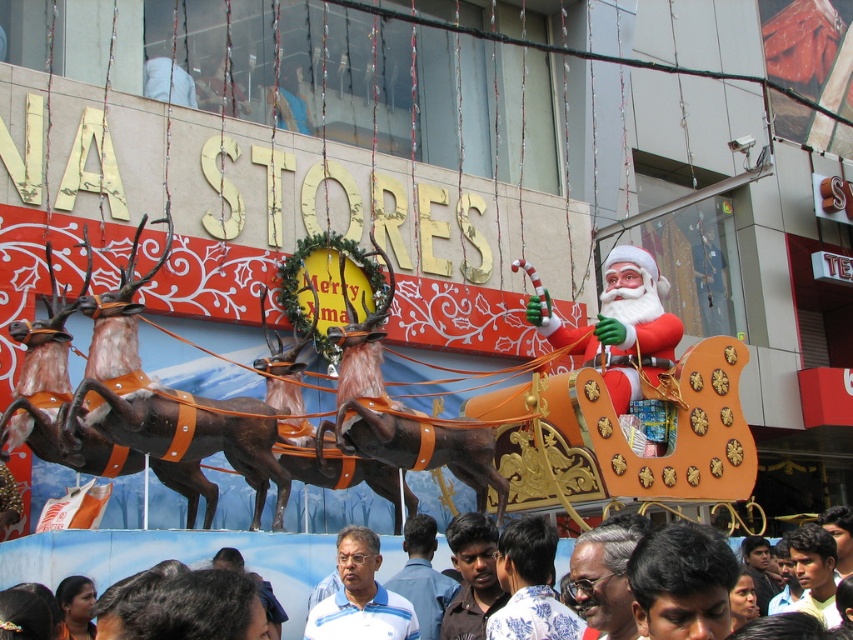
You are a parade attendee standing at the front of the float. You want to hand a gift to the red glossy santa claus at center but also need to avoid stepping on the white fabric shirt at lower center. Can you reach Santa without stepping on the shirt?

The distance between the red glossy santa claus at center and the white fabric shirt at lower center is 85.40 feet. Since you are at the front of the float, you would need to cover this distance to reach Santa, but stepping on the shirt would require being closer. However, given the significant distance, you cannot reach Santa without moving far beyond the shirt, so you can safely reach Santa without stepping on the shirt.

You are organizing a photo shoot and need to ensure proper lighting for both the red glossy santa claus at center and the blue shirt at center. Given their sizes, which object should you focus on first to avoid shadows affecting the larger one?

The red glossy santa claus at center should be focused on first because it has a larger size compared to the blue shirt at center, so shadows may affect it more significantly.